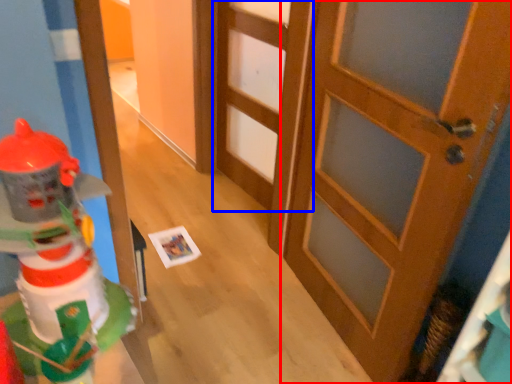
Question: Which object is further to the camera taking this photo, door (highlighted by a red box) or door (highlighted by a blue box)?

Choices:
 (A) door
 (B) door

Answer: (B)